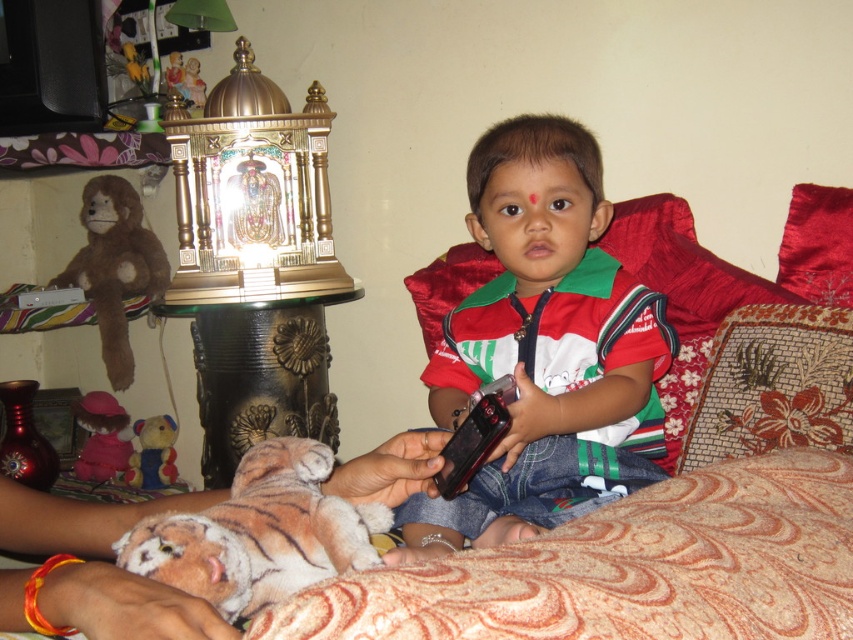
Question: Which of these objects is positioned farthest from the velvet plush toy at lower left?

Choices:
 (A) velvety brown teddy bear at lower left
 (B) brown plush monkey at left

Answer: (B)

Question: Which is farther from the matte red shirt at center?

Choices:
 (A) brown plush monkey at left
 (B) velvety brown teddy bear at lower left
 (C) velvet plush toy at lower left
 (D) soft plush tiger at lower left

Answer: (C)

Question: Does velvet plush toy at lower left appear on the right side of velvety brown teddy bear at lower left?

Choices:
 (A) yes
 (B) no

Answer: (B)

Question: Which point appears farthest from the camera in this image?

Choices:
 (A) (128, 224)
 (B) (241, 488)
 (C) (489, 481)
 (D) (115, 413)

Answer: (D)

Question: Is matte red shirt at center bigger than velvety brown teddy bear at lower left?

Choices:
 (A) no
 (B) yes

Answer: (B)

Question: Is velvet plush toy at lower left positioned at the back of velvety brown teddy bear at lower left?

Choices:
 (A) yes
 (B) no

Answer: (A)